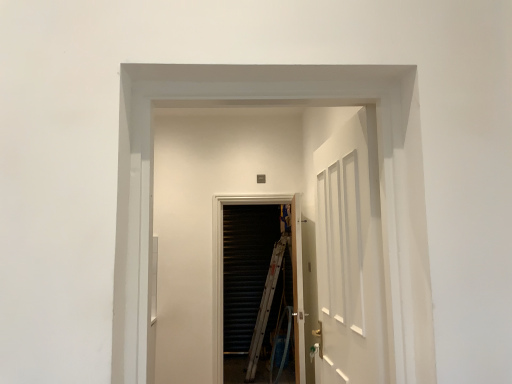
Question: Is black metal screen door at center not close to white glossy elevator at center?

Choices:
 (A) yes
 (B) no

Answer: (B)

Question: Can you confirm if black metal screen door at center is smaller than white glossy elevator at center?

Choices:
 (A) no
 (B) yes

Answer: (A)

Question: Does black metal screen door at center lie in front of white glossy elevator at center?

Choices:
 (A) yes
 (B) no

Answer: (B)

Question: Can you see black metal screen door at center touching white glossy elevator at center?

Choices:
 (A) no
 (B) yes

Answer: (A)

Question: Can you confirm if black metal screen door at center is taller than white glossy elevator at center?

Choices:
 (A) no
 (B) yes

Answer: (B)

Question: Is white wooden door at center to the left or to the right of black metal screen door at center in the image?

Choices:
 (A) left
 (B) right

Answer: (B)

Question: Is white wooden door at center spatially inside black metal screen door at center, or outside of it?

Choices:
 (A) outside
 (B) inside

Answer: (A)

Question: Is white wooden door at center taller or shorter than black metal screen door at center?

Choices:
 (A) short
 (B) tall

Answer: (A)

Question: In terms of width, does white wooden door at center look wider or thinner when compared to black metal screen door at center?

Choices:
 (A) thin
 (B) wide

Answer: (A)

Question: In terms of width, does white wooden door at center look wider or thinner when compared to white glossy elevator at center?

Choices:
 (A) wide
 (B) thin

Answer: (B)

Question: From a real-world perspective, is white wooden door at center positioned above or below white glossy elevator at center?

Choices:
 (A) below
 (B) above

Answer: (A)

Question: Would you say white wooden door at center is to the left or to the right of white glossy elevator at center in the picture?

Choices:
 (A) left
 (B) right

Answer: (B)

Question: From the image's perspective, relative to white glossy elevator at center, is white wooden door at center above or below?

Choices:
 (A) above
 (B) below

Answer: (B)

Question: Is white glossy elevator at center wider or thinner than black metal screen door at center?

Choices:
 (A) wide
 (B) thin

Answer: (A)

Question: In terms of size, does white glossy elevator at center appear bigger or smaller than black metal screen door at center?

Choices:
 (A) small
 (B) big

Answer: (A)